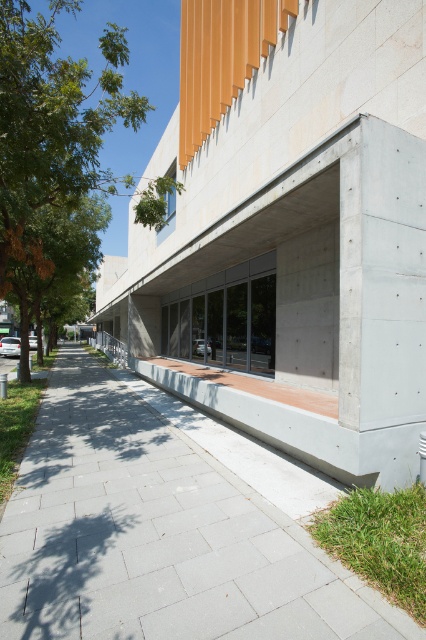
Describe the element at coordinates (166, 529) in the screenshot. I see `gray concrete pavement at center` at that location.

The image size is (426, 640). I want to click on gray concrete pavement at center, so click(166, 529).